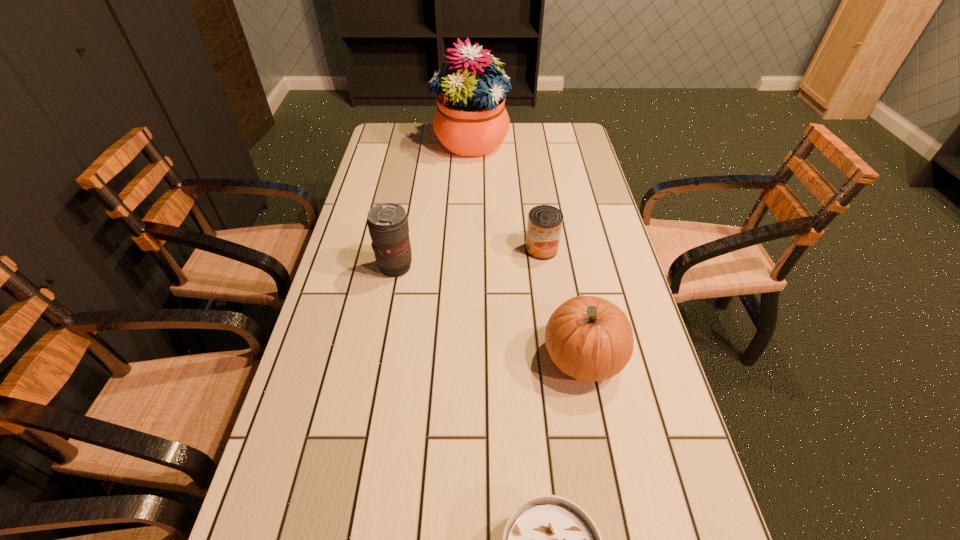
What are the coordinates of `flower arrangement` in the screenshot? It's located at (470, 120).

The image size is (960, 540). Find the location of `the farthest object`. the farthest object is located at coordinates (470, 120).

Identify the location of pumpkin. (589, 338).

You are a GUI agent. You are given a task and a screenshot of the screen. Output one action in this format:
    pyautogui.click(x=<x>, y=<y>)
    Task: Click on the telephoto lens
    This screenshot has height=540, width=960.
    Given the screenshot: What is the action you would take?
    pyautogui.click(x=388, y=226)

Find the location of a particular element. The image size is (960, 540). the second shortest object is located at coordinates (544, 225).

At what (x,y) coordinates should I click in order to perform the action: click on vacant region located on the front of the farthest object. Please return your answer as a coordinate pair (x, y). The width and height of the screenshot is (960, 540). Looking at the image, I should click on point(469,173).

The width and height of the screenshot is (960, 540). I want to click on vacant space situated 0.090m on the stem of the pumpkin, so click(x=503, y=358).

You are a GUI agent. You are given a task and a screenshot of the screen. Output one action in this format:
    pyautogui.click(x=<x>, y=<y>)
    Task: Click on the vacant space located 0.180m on the stem of the pumpkin
    This screenshot has width=960, height=540.
    Given the screenshot: What is the action you would take?
    pyautogui.click(x=466, y=358)

You are a GUI agent. You are given a task and a screenshot of the screen. Output one action in this format:
    pyautogui.click(x=<x>, y=<y>)
    Task: Click on the vacant space located on the stem of the pumpkin
    
    Given the screenshot: What is the action you would take?
    pyautogui.click(x=482, y=358)

This screenshot has height=540, width=960. I want to click on vacant area situated 0.130m on the side of the telephoto lens where the control switches are located, so click(x=460, y=267).